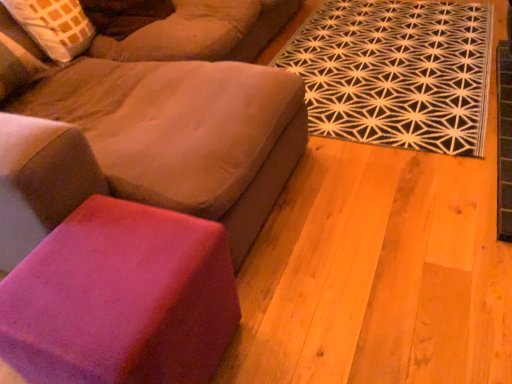
Where is `vacant region below black geometric rug at upper right (from a real-world perspective)`? vacant region below black geometric rug at upper right (from a real-world perspective) is located at coordinates (413, 56).